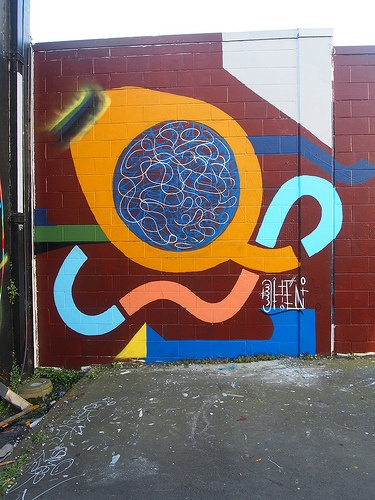
Locate an element on the screen. red brick wall is located at coordinates click(351, 309).